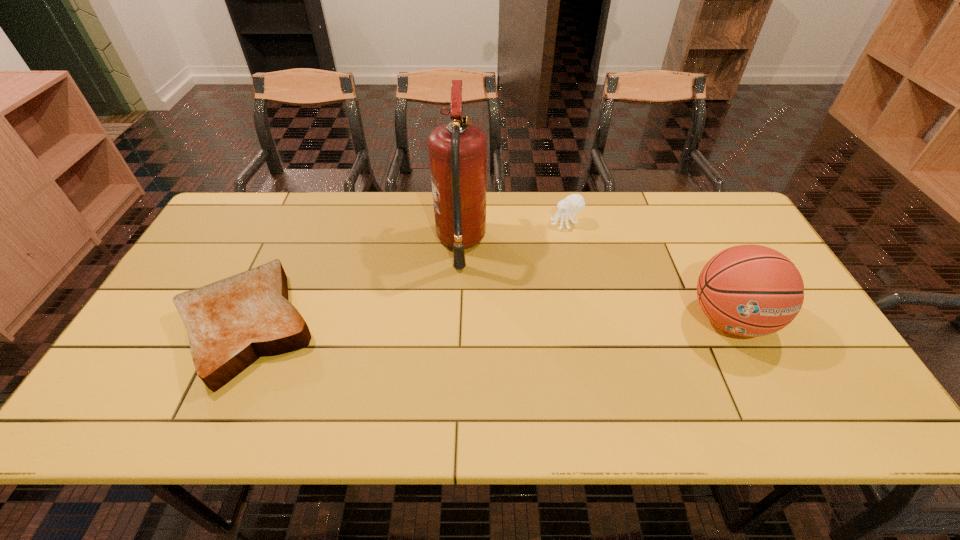
Find the location of `vacant space located 0.310m on the front-facing side of the second object from right to left`. vacant space located 0.310m on the front-facing side of the second object from right to left is located at coordinates (453, 224).

Where is `free region located 0.390m on the front-facing side of the second object from right to left`? This screenshot has width=960, height=540. free region located 0.390m on the front-facing side of the second object from right to left is located at coordinates 428,224.

In order to click on free space located on the front-facing side of the second object from right to left in this screenshot , I will do `click(444, 224)`.

What are the coordinates of `free spot located 0.350m on the right of the leftmost object` in the screenshot? It's located at (453, 327).

Find the location of a particular element. The height and width of the screenshot is (540, 960). fire extinguisher at the far edge is located at coordinates (458, 150).

The width and height of the screenshot is (960, 540). In order to click on octopus that is at the far edge in this screenshot , I will do 574,203.

Locate an element on the screen. The height and width of the screenshot is (540, 960). object present at the near edge is located at coordinates (231, 323).

The image size is (960, 540). I want to click on object at the left edge, so click(231, 323).

At what (x,y) coordinates should I click in order to perform the action: click on object that is at the right edge. Please return your answer as a coordinate pair (x, y). This screenshot has height=540, width=960. Looking at the image, I should click on (748, 290).

This screenshot has height=540, width=960. I want to click on object at the near left corner, so (231, 323).